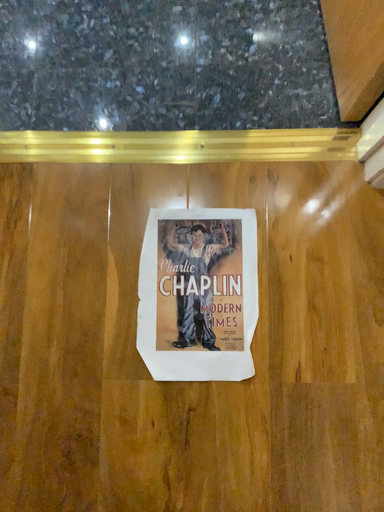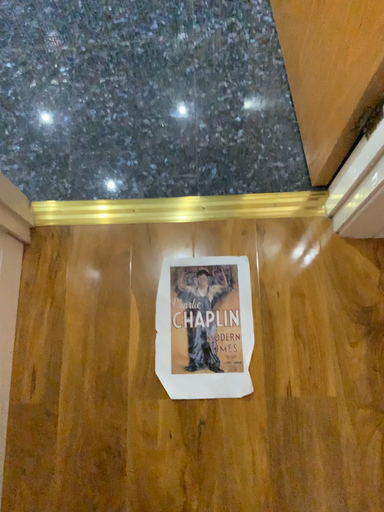
Question: Which way did the camera rotate in the video?

Choices:
 (A) rotated downward
 (B) rotated upward

Answer: (B)